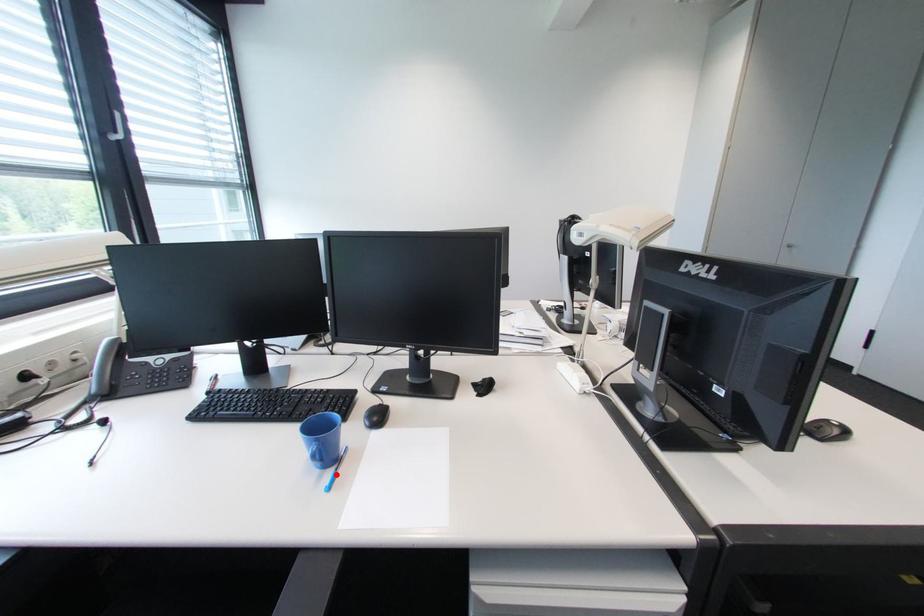
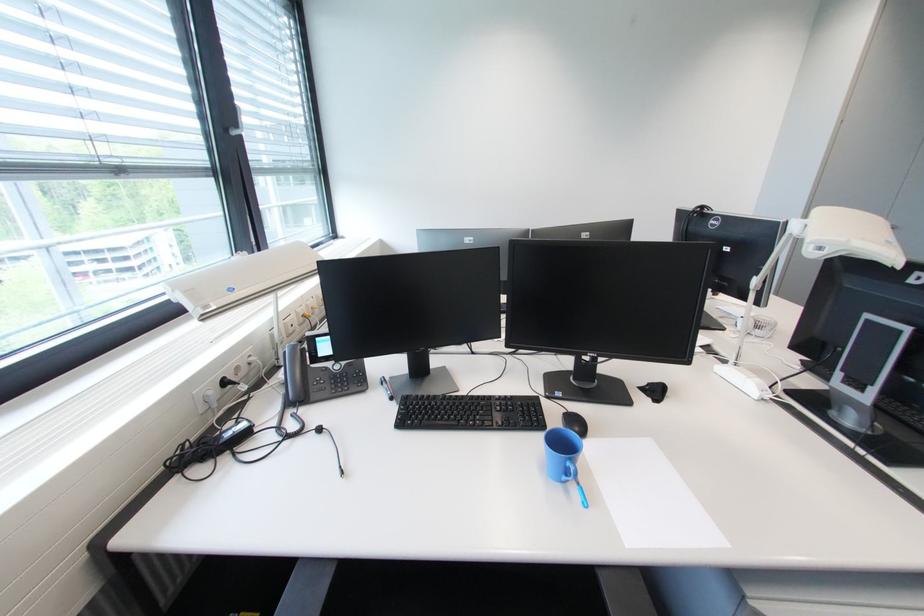
Where in the second image is the point corresponding to the highlighted location from the first image?

(579, 488)